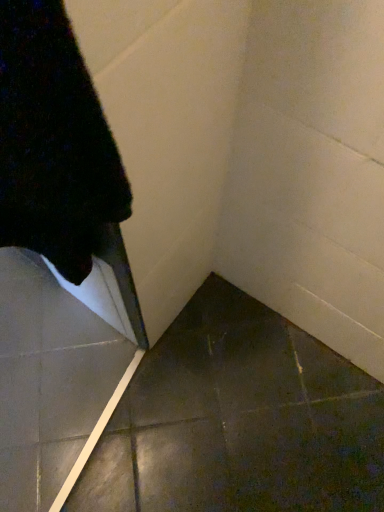
Question: Should I look upward or downward to see dark gray tile at lower left?

Choices:
 (A) down
 (B) up

Answer: (A)